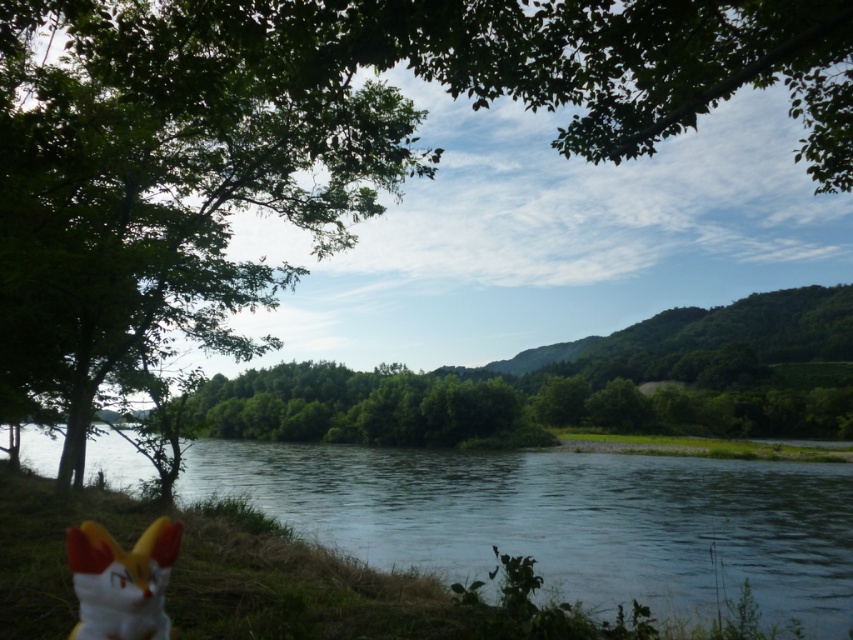
At what (x,y) coordinates should I click in order to perform the action: click on clear water at center. Please return your answer as a coordinate pair (x, y). The width and height of the screenshot is (853, 640). Looking at the image, I should click on (566, 518).

Can you confirm if clear water at center is shorter than white matte plush toy at lower left?

No, clear water at center is not shorter than white matte plush toy at lower left.

Does point (663, 467) come closer to viewer compared to point (138, 618)?

No, (663, 467) is further to viewer.

Find the location of a particular element. clear water at center is located at coordinates (566, 518).